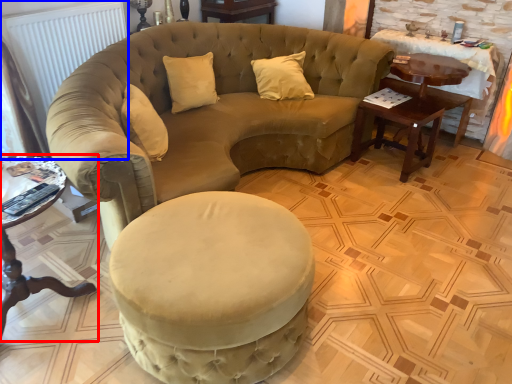
Question: Among these objects, which one is nearest to the camera, table (highlighted by a red box) or radiator (highlighted by a blue box)?

Choices:
 (A) table
 (B) radiator

Answer: (A)